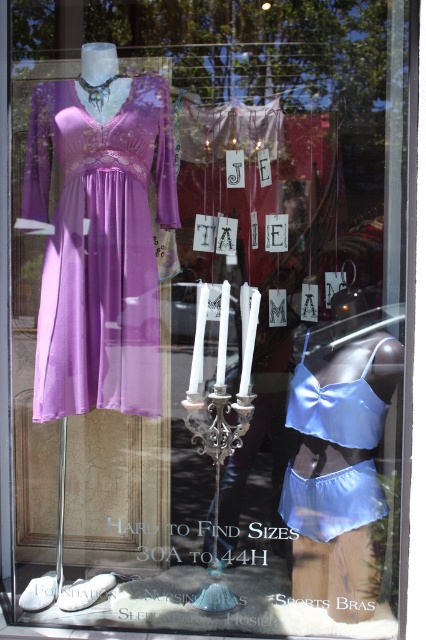
Does matte purple dress at left have a smaller size compared to satin blue lingerie at center?

No.

Can you confirm if matte purple dress at left is positioned to the left of satin blue lingerie at center?

Yes, matte purple dress at left is to the left of satin blue lingerie at center.

Is point (154, 275) positioned in front of point (299, 504)?

Yes, point (154, 275) is in front of point (299, 504).

Locate an element on the screen. The width and height of the screenshot is (426, 640). matte purple dress at left is located at coordinates (100, 248).